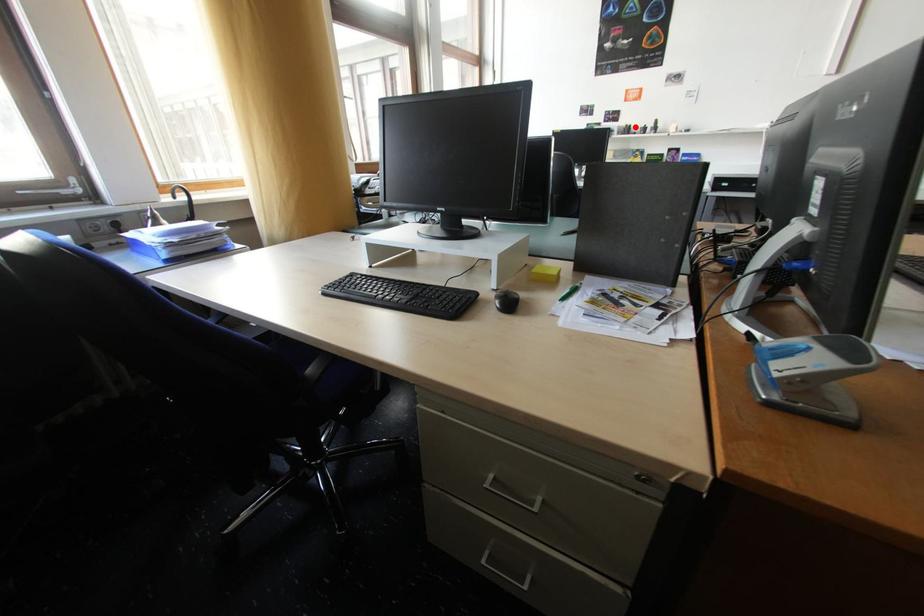
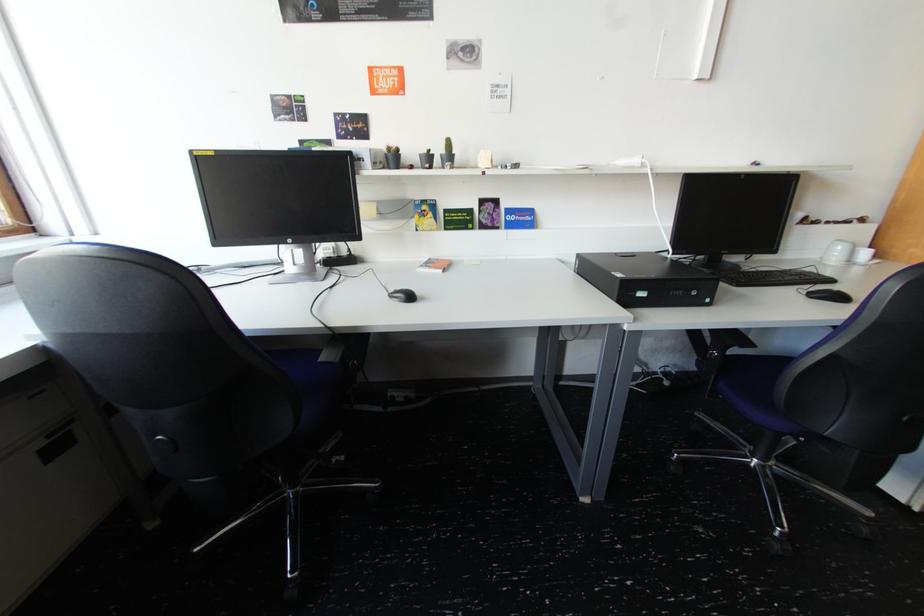
In the second image, find the point that corresponds to the highlighted location in the first image.

(397, 150)